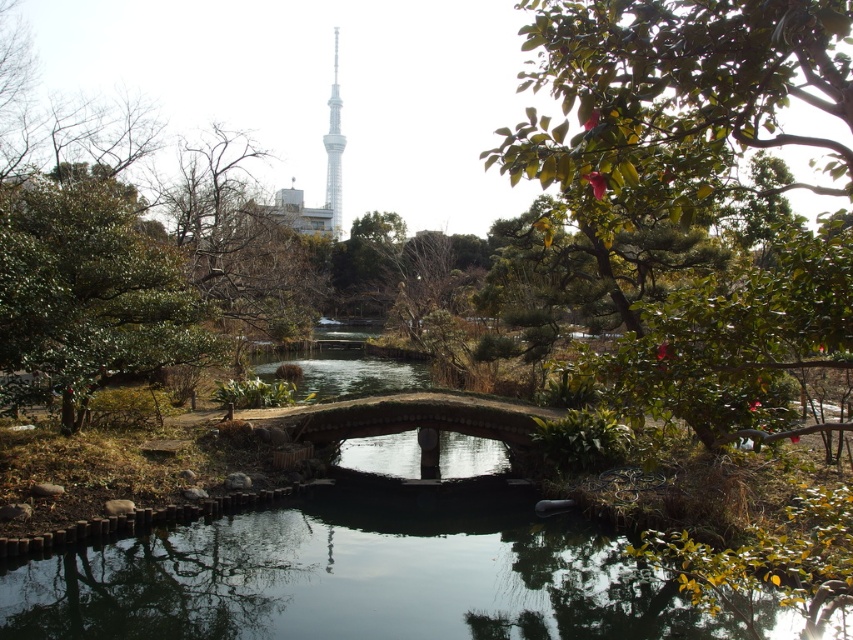
Question: Does green leafy tree at center have a lesser width compared to green leafy tree at left?

Choices:
 (A) no
 (B) yes

Answer: (B)

Question: Considering the real-world distances, which object is closest to the green leafy tree at center?

Choices:
 (A) green leafy tree at left
 (B) white glassy eiffel tower at upper center

Answer: (A)

Question: Which is farther from the white glassy eiffel tower at upper center?

Choices:
 (A) green leafy tree at center
 (B) green leafy tree at left

Answer: (A)

Question: Is green leafy tree at center positioned at the back of white glassy eiffel tower at upper center?

Choices:
 (A) no
 (B) yes

Answer: (A)

Question: Is green leafy tree at center wider than green leafy tree at left?

Choices:
 (A) no
 (B) yes

Answer: (A)

Question: Which point appears closest to the camera in this image?

Choices:
 (A) (67, 118)
 (B) (334, 220)
 (C) (605, 184)

Answer: (C)